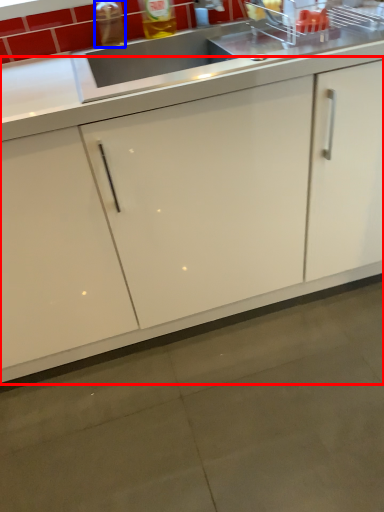
Question: Which object appears farthest to the camera in this image, cabinetry (highlighted by a red box) or bottle (highlighted by a blue box)?

Choices:
 (A) cabinetry
 (B) bottle

Answer: (B)